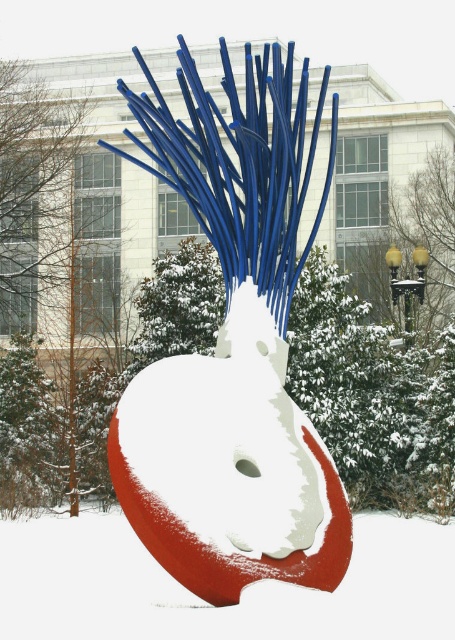
You are an artist planning to paint a mural inspired by the sculpture. You need to know which part of the sculpture is larger to scale your design correctly. Which is bigger, the smooth glossy sculpture at center or the smooth red sculpture at center?

The smooth glossy sculpture at center is bigger than the smooth red sculpture at center according to the description.

You are standing in front of the sculpture and want to touch both the smooth glossy sculpture at center and the smooth red sculpture at center. Which one should you reach for first?

You should reach for the smooth glossy sculpture at center first because it is closer to you than the smooth red sculpture at center.